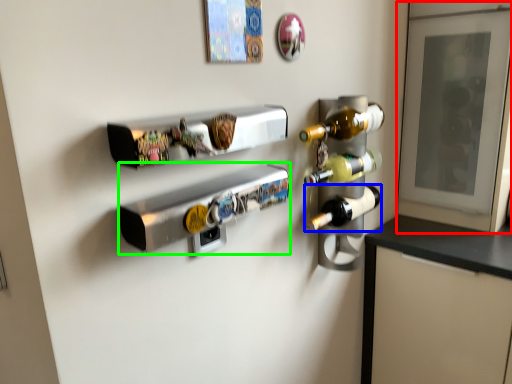
Question: Considering the real-world distances, which object is farthest from glass door (highlighted by a red box)? bottle (highlighted by a blue box) or appliance (highlighted by a green box)?

Choices:
 (A) bottle
 (B) appliance

Answer: (B)